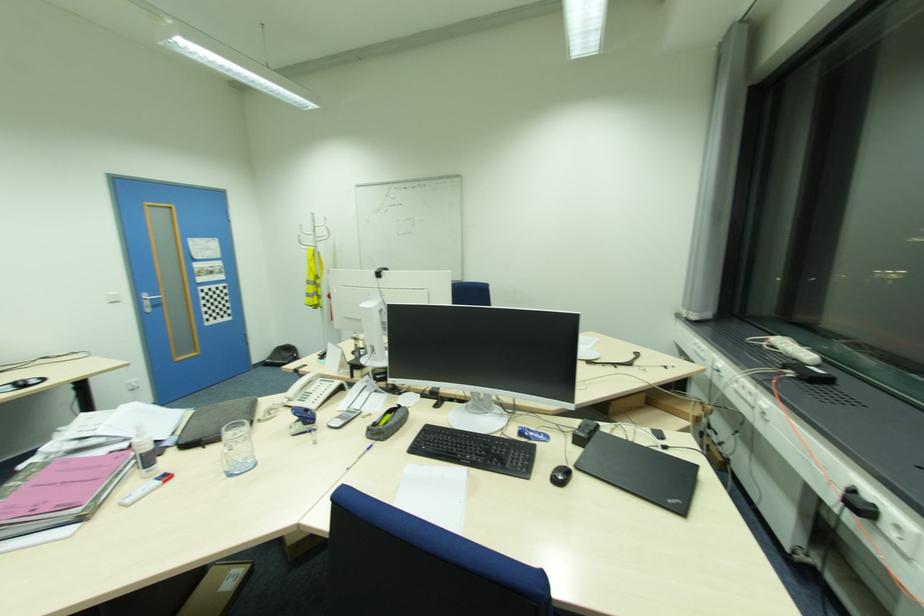
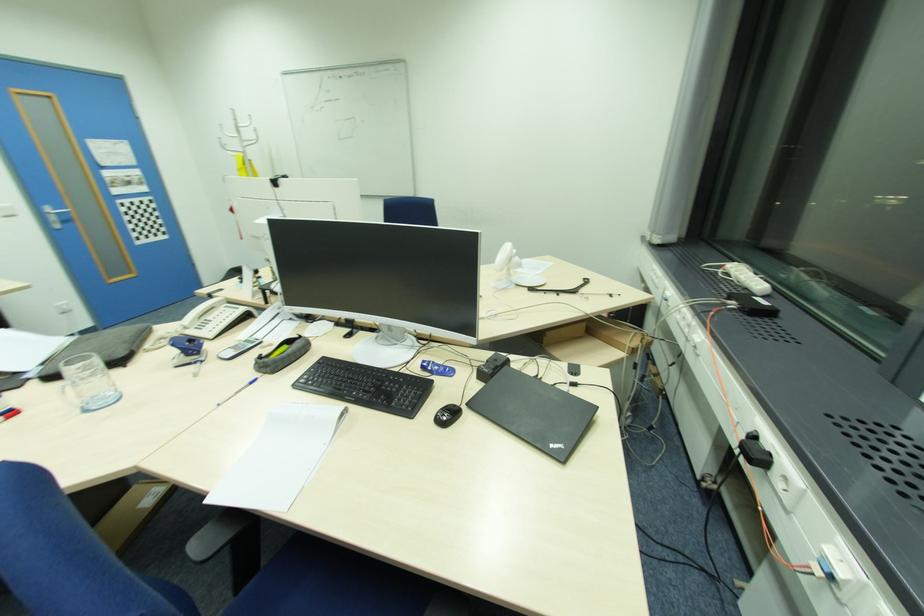
Where in the second image is the point corresponding to point (564, 477) from the first image?

(447, 418)